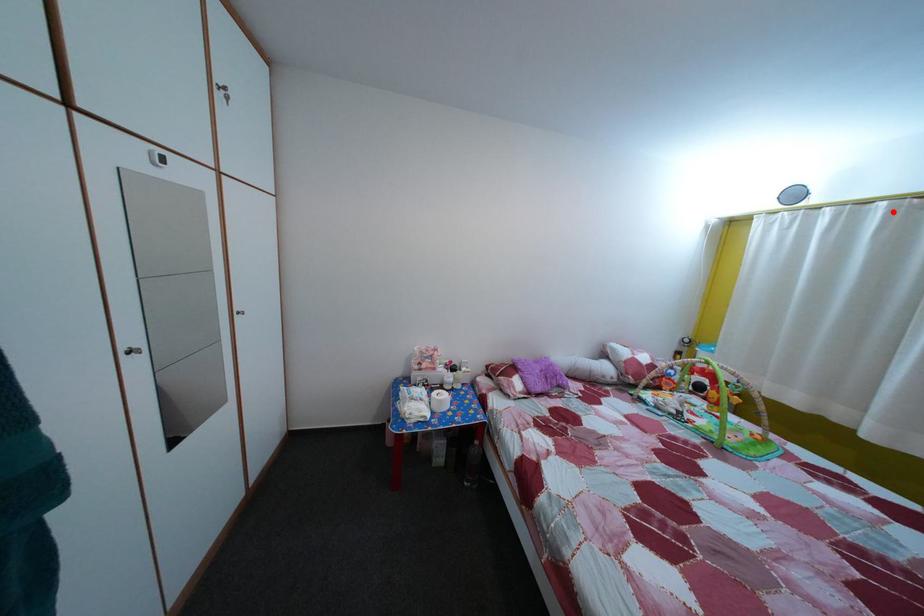
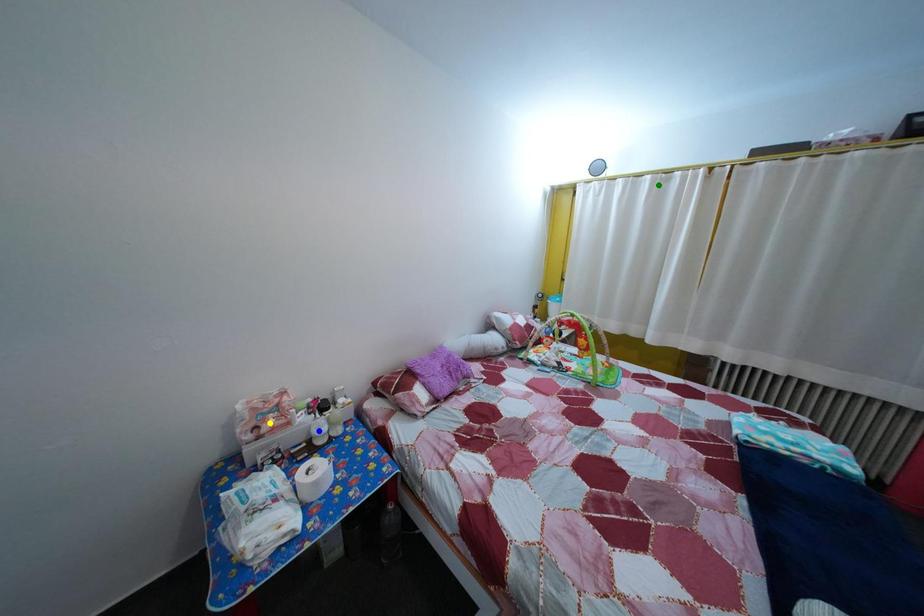
Question: I am providing you with two images of the same scene from different viewpoints. A red point is marked on the first image. You are given multiple points on the second image. Which point in image 2 is actually the same real-world point as the red point in image 1?

Choices:
 (A) yellow point
 (B) blue point
 (C) green point

Answer: (C)